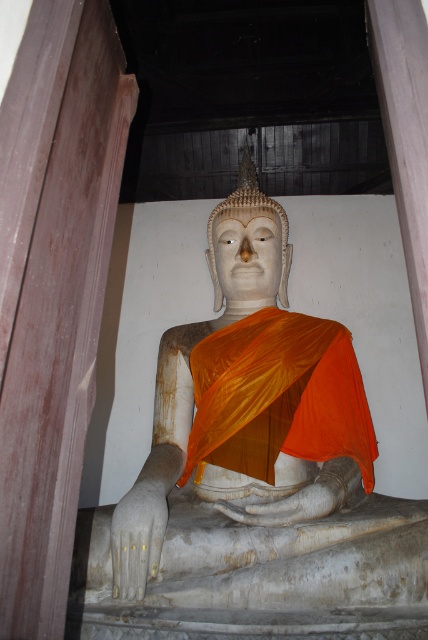
You are a visitor standing in front of the white marble statue at center. The temple has a strict rule that visitors must stay at least 15 feet away from any statues to prevent damage. Are you in compliance with this rule?

The distance between you and the white marble statue at center is 12.92 feet, which is less than the required 15 feet. Therefore, you are not in compliance with the temple rule and should move back to maintain the proper distance.

You are a temple visitor who wants to take a photo of the white marble statue at center and the orange silk robe at center. If you want to ensure both are fully visible in the frame, which object should you focus on first to adjust your camera angle?

You should focus on the white marble statue at center first because it is taller than the orange silk robe at center, so adjusting the angle to accommodate its height will naturally include the robe in the frame.

You are a temple visitor who wants to take a photo of the white marble statue at center and the orange silk robe at center. Since the statue is in front of the robe, will the robe be fully visible in the photo?

The white marble statue at center is in front of the orange silk robe at center, so part of the robe may be blocked by the statue in the photo.